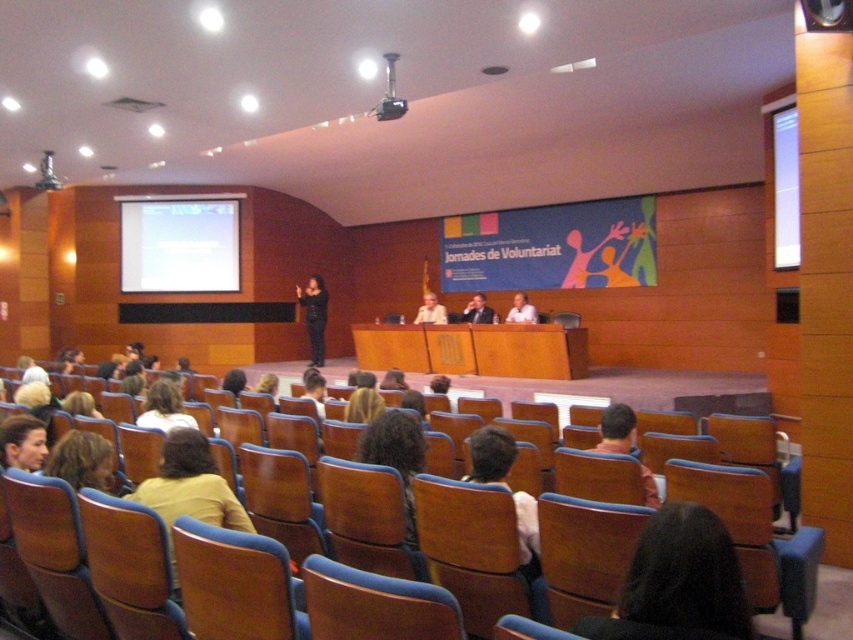
Question: Which object is positioned closest to the light beige shirt at center?

Choices:
 (A) wooden seat at center
 (B) curly hair at center

Answer: (B)

Question: Can you confirm if brown wood chair at lower left is positioned above matte black dress at center?

Choices:
 (A) yes
 (B) no

Answer: (B)

Question: Which object appears farthest from the camera in this image?

Choices:
 (A) light brown wood table at center
 (B) wooden seat at center

Answer: (A)

Question: Which of the following is the closest to the observer?

Choices:
 (A) curly hair at center
 (B) light beige shirt at center
 (C) brown wood chair at lower left

Answer: (C)

Question: Can you confirm if brown wood chair at lower left is positioned to the right of matte black dress at center?

Choices:
 (A) yes
 (B) no

Answer: (A)

Question: Does wooden seat at center appear on the right side of black plastic projector at upper center?

Choices:
 (A) no
 (B) yes

Answer: (A)